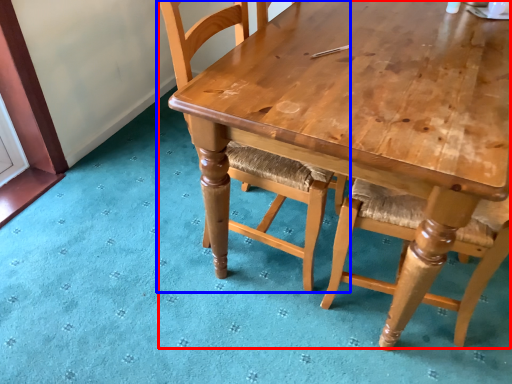
Question: Among these objects, which one is farthest to the camera, table (highlighted by a red box) or chair (highlighted by a blue box)?

Choices:
 (A) table
 (B) chair

Answer: (B)